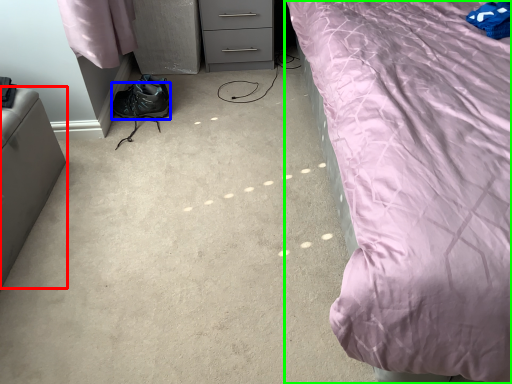
Question: Estimate the real-world distances between objects in this image. Which object is closer to furniture (highlighted by a red box), shoe (highlighted by a blue box) or bed (highlighted by a green box)?

Choices:
 (A) shoe
 (B) bed

Answer: (A)